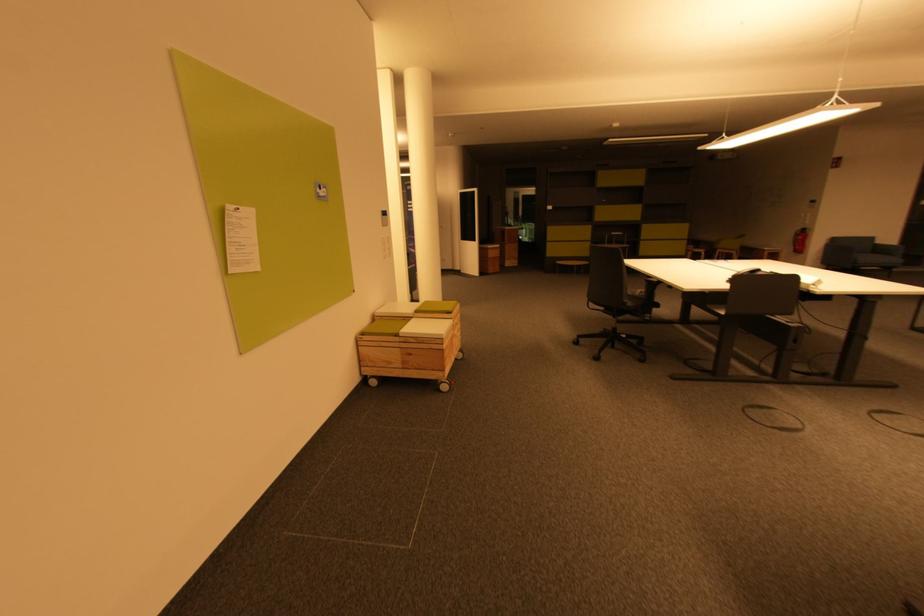
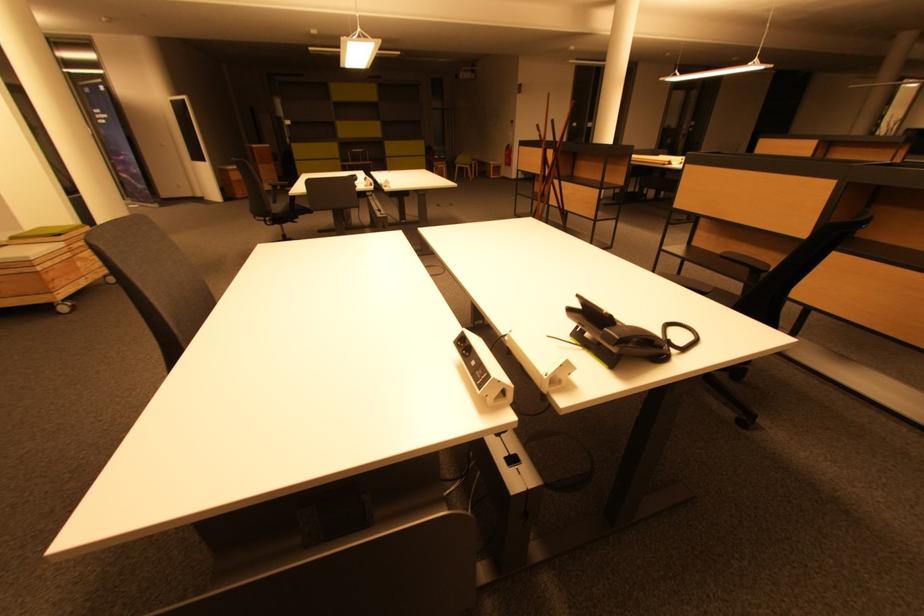
Locate, in the second image, the point that corresponds to pixel 457 342 in the first image.

(83, 265)